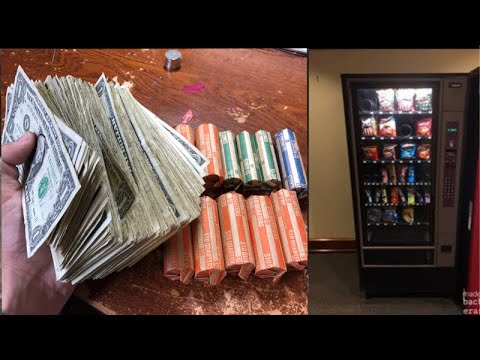
You are a GUI agent. You are given a task and a screenshot of the screen. Output one action in this format:
    pyautogui.click(x=<x>, y=<y>)
    Task: Click on the keypad
    
    Given the screenshot: What is the action you would take?
    pyautogui.click(x=452, y=193)